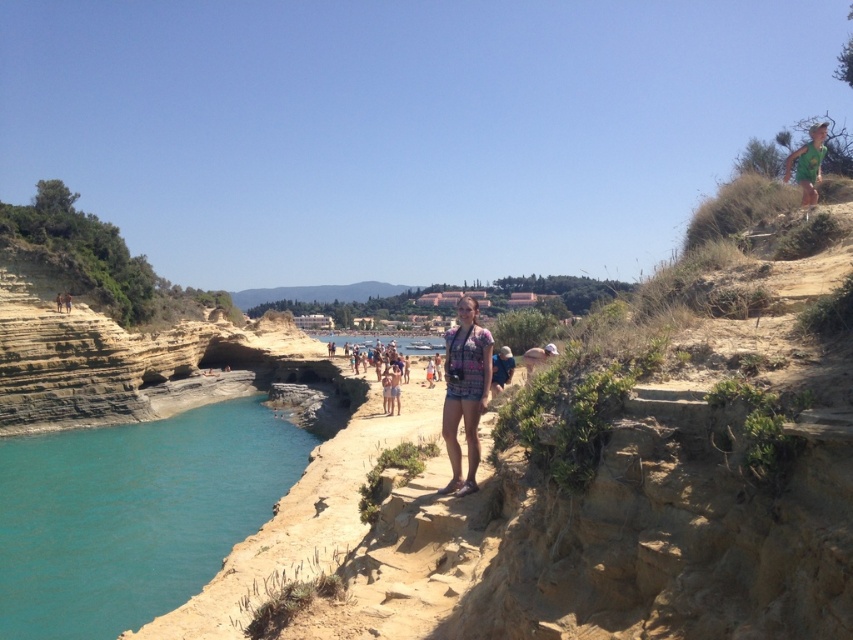
Question: Estimate the real-world distances between objects in this image. Which object is farther from the turquoise water at lower left?

Choices:
 (A) tan skin person at center
 (B) green fabric shorts at upper right
 (C) light blue denim shorts at center

Answer: (B)

Question: Is turquoise water at lower left positioned in front of matte blue shirt at center?

Choices:
 (A) yes
 (B) no

Answer: (A)

Question: Considering the relative positions of pink floral shorts at center and plaid shirt at center in the image provided, where is pink floral shorts at center located with respect to plaid shirt at center?

Choices:
 (A) right
 (B) left

Answer: (B)

Question: Among these points, which one is farthest from the camera?

Choices:
 (A) (119, 428)
 (B) (64, 298)

Answer: (B)

Question: Does green fabric shorts at upper right appear under plaid shirt at center?

Choices:
 (A) yes
 (B) no

Answer: (B)

Question: Which point is closer to the camera?

Choices:
 (A) tan skin person at center
 (B) plaid shirt at center

Answer: (B)